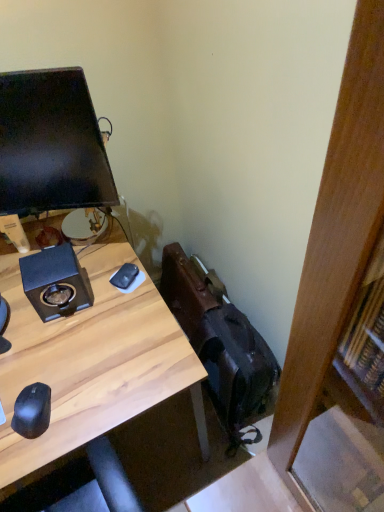
Identify the location of free space between black matte speaker at upper left and black matte mouse at center, the first mouse when ordered from top to bottom. (102, 287).